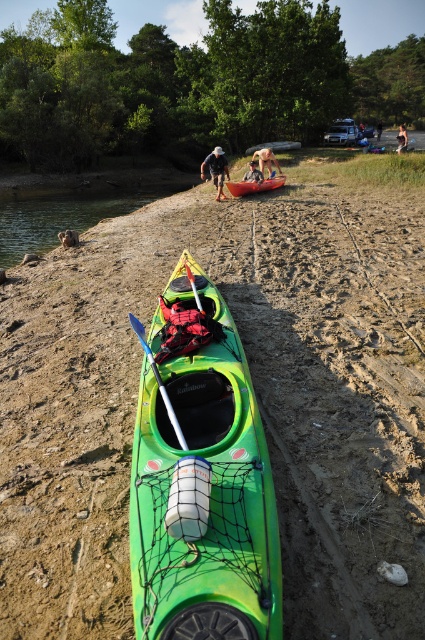
Is green matte kayak at center wider than white plastic paddle at center?

Yes, green matte kayak at center is wider than white plastic paddle at center.

Is point (164, 396) in front of point (144, 342)?

Yes, point (164, 396) is in front of point (144, 342).

Find the location of a particular element. The image size is (425, 640). green matte kayak at center is located at coordinates (201, 480).

Who is shorter, green matte kayak at center or light brown wooden paddle at center?

light brown wooden paddle at center

Which is behind, point (195, 614) or point (252, 168)?

Positioned behind is point (252, 168).

The width and height of the screenshot is (425, 640). In order to click on green matte kayak at center in this screenshot , I will do `click(201, 480)`.

Who is more distant from viewer, (206, 164) or (379, 131)?

Positioned behind is point (379, 131).

Find the location of a particular element. The height and width of the screenshot is (640, 425). dark blue fabric shirt at upper center is located at coordinates (215, 170).